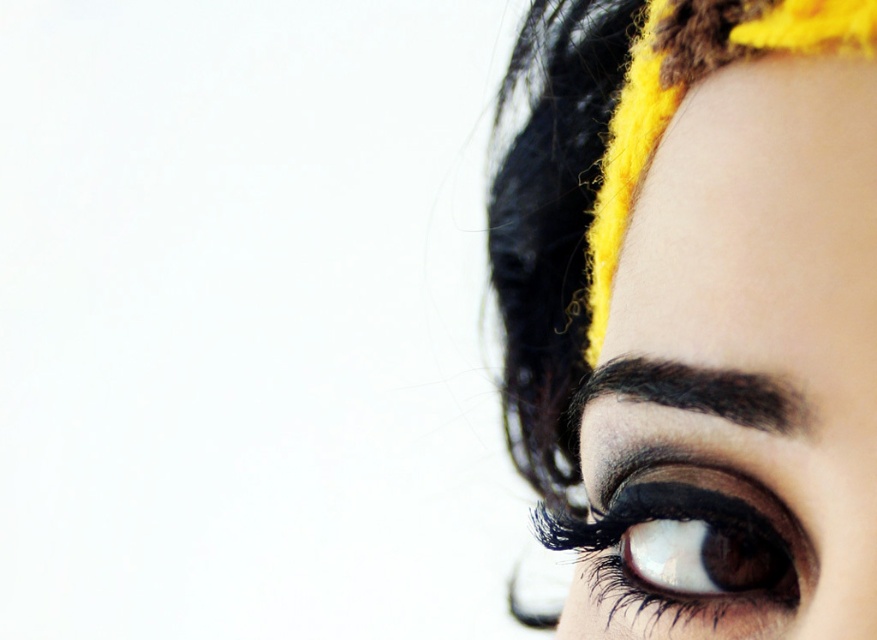
You are an artist trying to paint this portrait. You need to decide which point to start with based on their depth. Which point is closer to you, point (707,609) or point (660,381)?

Point (707,609) is closer to you than point (660,381).

You are a makeup artist trying to replicate the look from the image. The matte black eye at upper right is crucial for the design. If you want to place it precisely, where should you position it on the face?

The matte black eye at upper right should be positioned at point coordinates of approximately 0.489 on the x axis and 0.796 on the y axis.